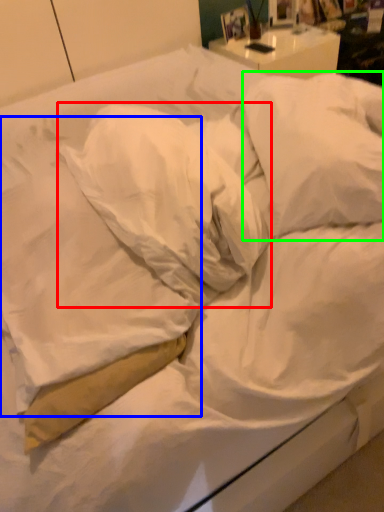
Question: Which object is positioned closest to pillow (highlighted by a red box)? Select from pillow (highlighted by a blue box) and pillow (highlighted by a green box).

Choices:
 (A) pillow
 (B) pillow

Answer: (A)